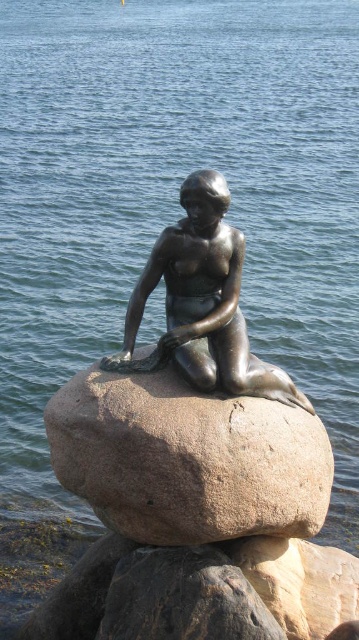
Question: Observing the image, what is the correct spatial positioning of brown granite rock at center in reference to bronze statue at center?

Choices:
 (A) below
 (B) above

Answer: (A)

Question: Does brown granite rock at center appear under bronze statue at center?

Choices:
 (A) yes
 (B) no

Answer: (A)

Question: Does brown granite rock at center appear over bronze statue at center?

Choices:
 (A) no
 (B) yes

Answer: (A)